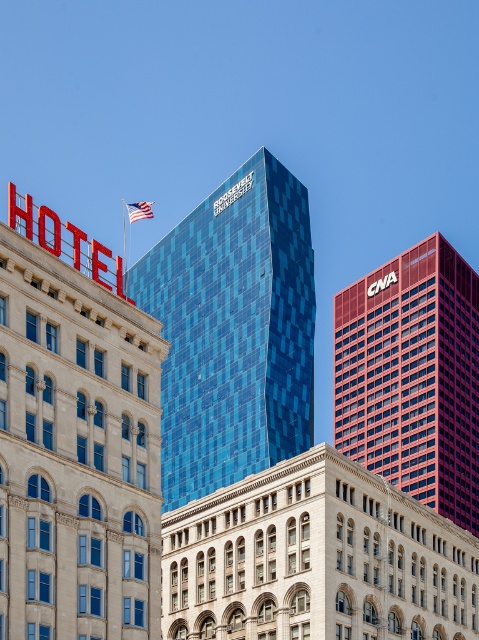
Does blue glass skyscraper at center have a larger size compared to matte red building at right?

Incorrect, blue glass skyscraper at center is not larger than matte red building at right.

Does blue glass skyscraper at center appear under matte red building at right?

Yes, blue glass skyscraper at center is below matte red building at right.

Which is in front, point (36, 262) or point (389, 390)?

Point (36, 262) is in front.

Find the location of a particular element. Image resolution: width=479 pixels, height=640 pixels. blue glass skyscraper at center is located at coordinates (76, 451).

Image resolution: width=479 pixels, height=640 pixels. What do you see at coordinates (76, 451) in the screenshot? I see `blue glass skyscraper at center` at bounding box center [76, 451].

Where is `blue glass skyscraper at center`? blue glass skyscraper at center is located at coordinates (76, 451).

Who is shorter, blue glass building at center or american flag at upper center?

Standing shorter between the two is american flag at upper center.

Which is more to the right, blue glass building at center or american flag at upper center?

blue glass building at center is more to the right.

Which is in front, point (234, 284) or point (128, 205)?

Point (234, 284) is in front.

Identify the location of blue glass building at center. (234, 330).